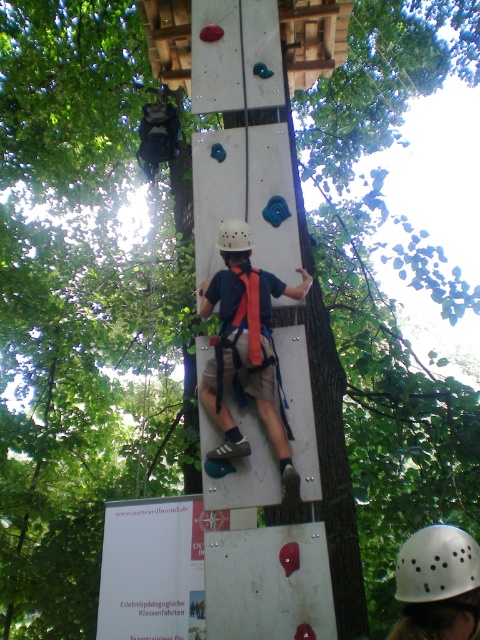
You are a safety inspector checking the setup of the climbing course. You notice the matte orange harness at center and the white matte helmet at center. Which object is positioned to the right side of the other?

The matte orange harness at center is to the right of the white matte helmet at center.

You are a safety inspector checking the setup of the climbing course. You notice the matte orange harness at center and the white matte helmet at lower right. Which one is positioned to the left side?

The matte orange harness at center is positioned to the left of the white matte helmet at lower right.

You are a safety inspector checking the climbing gear setup of the climber. The safety regulation requires that the distance between the matte orange harness at center and the white matte helmet at center must be less than 20 inches to ensure proper positioning. Based on the image, does this climber comply with the regulation?

The distance between the matte orange harness at center and the white matte helmet at center is 21.58 inches, which exceeds the 20 inches requirement. Therefore, the climber does not comply with the regulation.